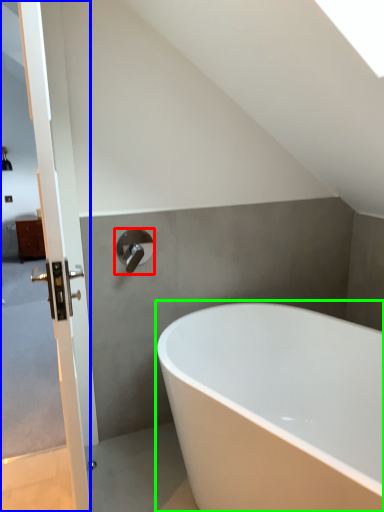
Question: Considering the real-world distances, which object is farthest from tap (highlighted by a red box)? screen door (highlighted by a blue box) or bathtub (highlighted by a green box)?

Choices:
 (A) screen door
 (B) bathtub

Answer: (B)